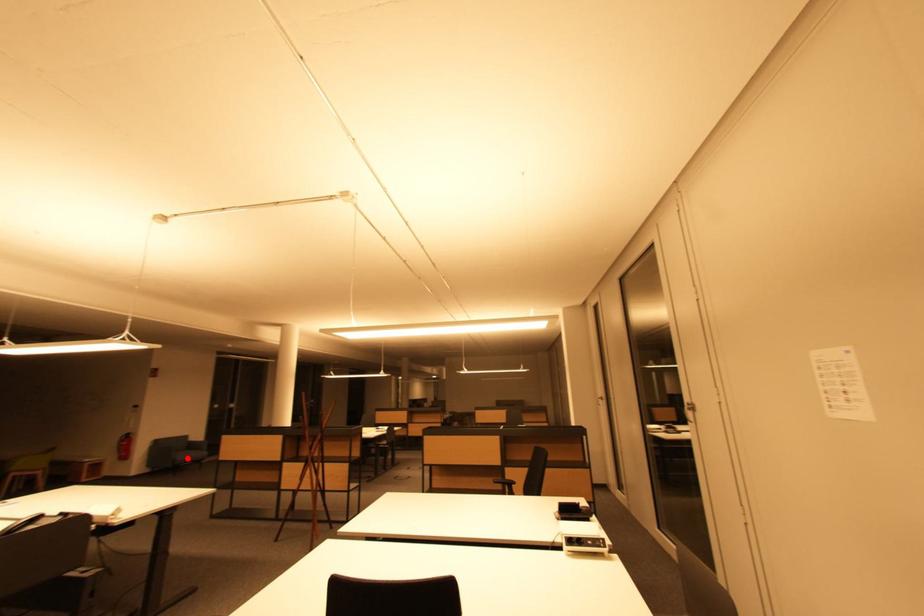
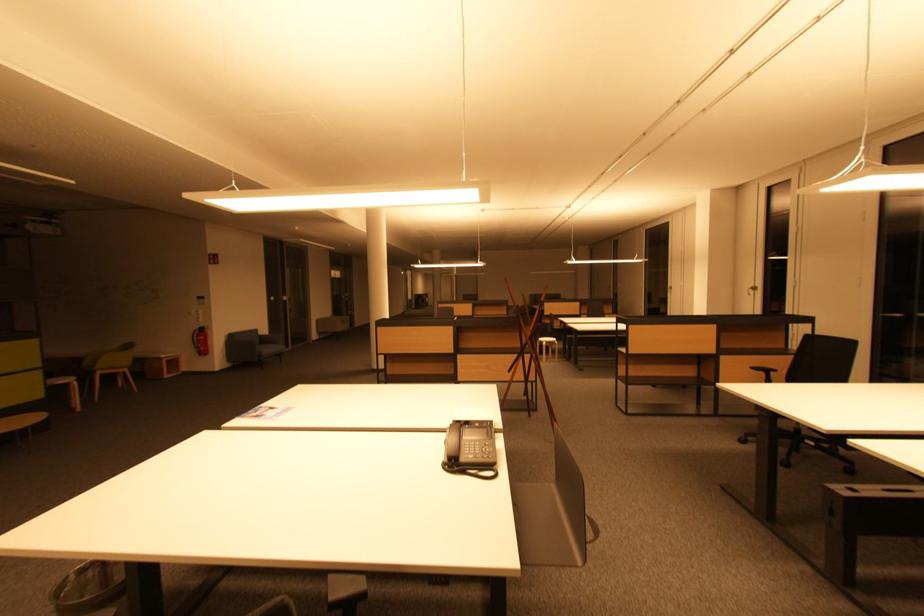
Question: I am providing you with two images of the same scene from different viewpoints. Image1 has a red point marked. In image2, the corresponding 3D location appears at what relative position? Reply with the corresponding letter.

Choices:
 (A) Closer
 (B) Farther

Answer: (A)